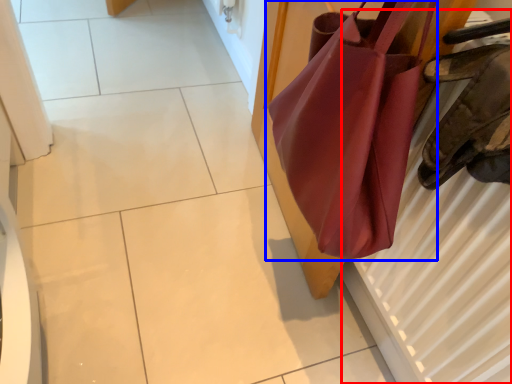
Question: Which point is closer to the camera, radiator (highlighted by a red box) or handbag (highlighted by a blue box)?

Choices:
 (A) radiator
 (B) handbag

Answer: (A)